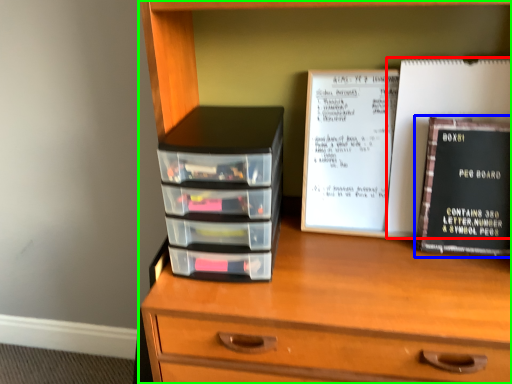
Question: Which is nearer to the paperback book (highlighted by a red box)? book (highlighted by a blue box) or chest of drawers (highlighted by a green box).

Choices:
 (A) book
 (B) chest of drawers

Answer: (A)